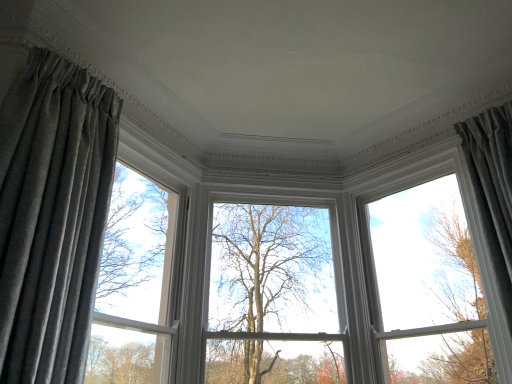
Question: Does velvet gray curtain at left, which is counted as the 2th curtain, starting from the right, touch white glossy window at upper center?

Choices:
 (A) no
 (B) yes

Answer: (A)

Question: From a real-world perspective, is velvet gray curtain at left, which is counted as the 2th curtain, starting from the right, positioned over white glossy window at upper center based on gravity?

Choices:
 (A) yes
 (B) no

Answer: (B)

Question: Considering the relative sizes of velvet gray curtain at left, the first curtain positioned from the left, and white glossy window at upper center in the image provided, is velvet gray curtain at left, the first curtain positioned from the left, taller than white glossy window at upper center?

Choices:
 (A) yes
 (B) no

Answer: (A)

Question: Would you consider velvet gray curtain at left, which is counted as the 2th curtain, starting from the right, to be distant from white glossy window at upper center?

Choices:
 (A) no
 (B) yes

Answer: (B)

Question: Considering the relative sizes of velvet gray curtain at left, which is counted as the 2th curtain, starting from the right, and white glossy window at upper center in the image provided, is velvet gray curtain at left, which is counted as the 2th curtain, starting from the right, bigger than white glossy window at upper center?

Choices:
 (A) yes
 (B) no

Answer: (A)

Question: Is the depth of velvet gray curtain at left, which is counted as the 2th curtain, starting from the right, less than that of white glossy window at upper center?

Choices:
 (A) no
 (B) yes

Answer: (B)

Question: Is white glossy window at upper center not near matte gray curtain at left?

Choices:
 (A) yes
 (B) no

Answer: (A)

Question: Does white glossy window at upper center lie behind matte gray curtain at left?

Choices:
 (A) yes
 (B) no

Answer: (A)

Question: Can you confirm if white glossy window at upper center is shorter than matte gray curtain at left?

Choices:
 (A) yes
 (B) no

Answer: (A)

Question: Does white glossy window at upper center have a greater width compared to matte gray curtain at left?

Choices:
 (A) no
 (B) yes

Answer: (A)

Question: Is white glossy window at upper center touching matte gray curtain at left?

Choices:
 (A) yes
 (B) no

Answer: (B)

Question: Does white glossy window at upper center have a smaller size compared to matte gray curtain at left?

Choices:
 (A) no
 (B) yes

Answer: (B)

Question: From a real-world perspective, is matte gray curtain at left on velvet gray curtain at left, the first curtain positioned from the left?

Choices:
 (A) no
 (B) yes

Answer: (B)